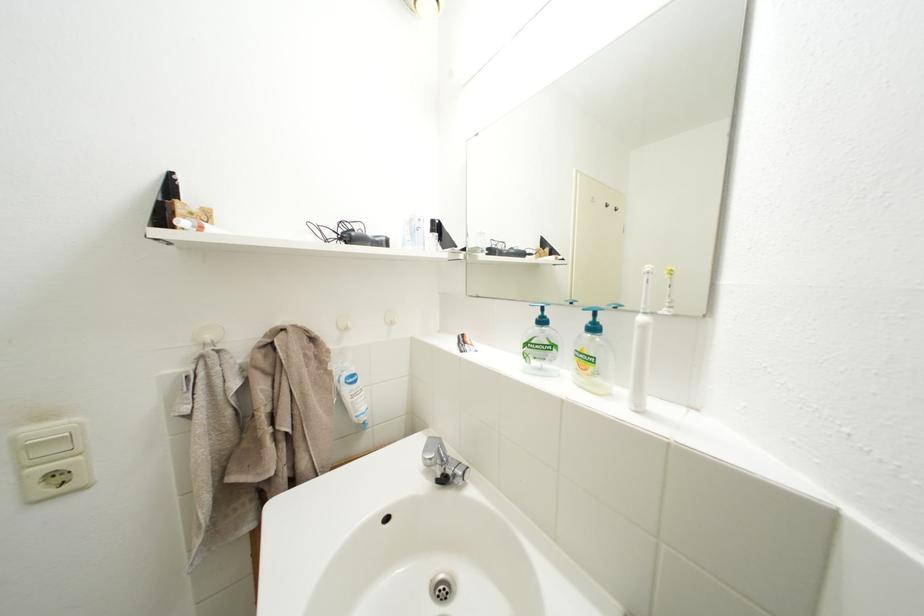
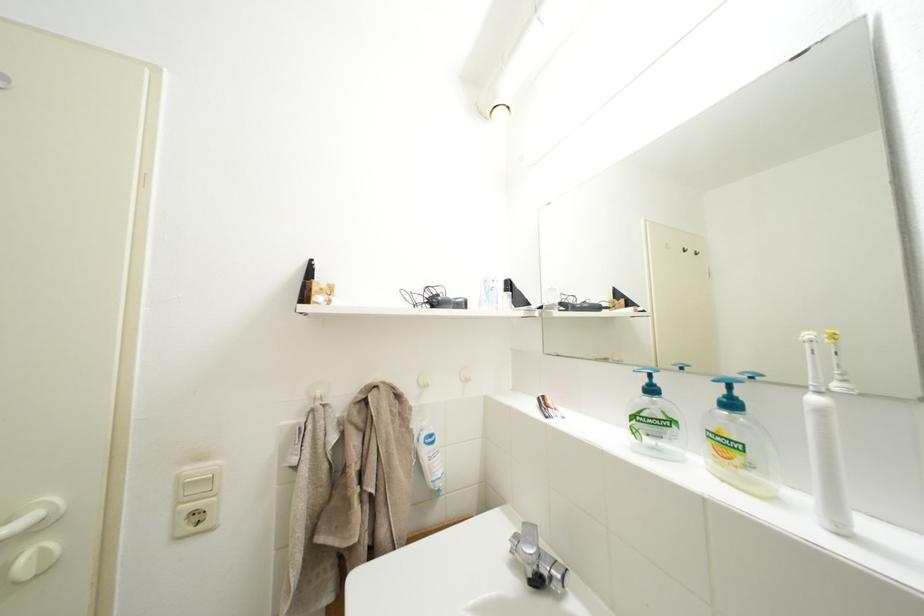
Question: Based on the continuous images, in which direction is the camera rotating? Reply with the corresponding letter.

Choices:
 (A) Left
 (B) Right
 (C) Up
 (D) Down

Answer: (A)